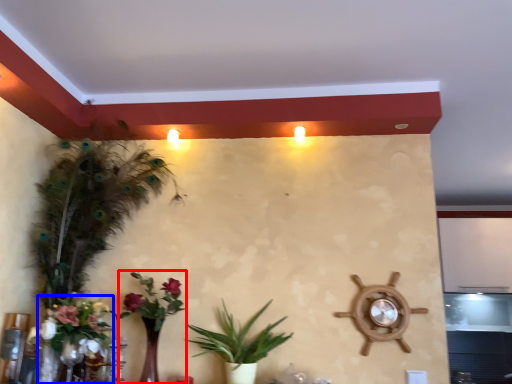
Question: Which point is closer to the camera, floral arrangement (highlighted by a red box) or floral arrangement (highlighted by a blue box)?

Choices:
 (A) floral arrangement
 (B) floral arrangement

Answer: (B)